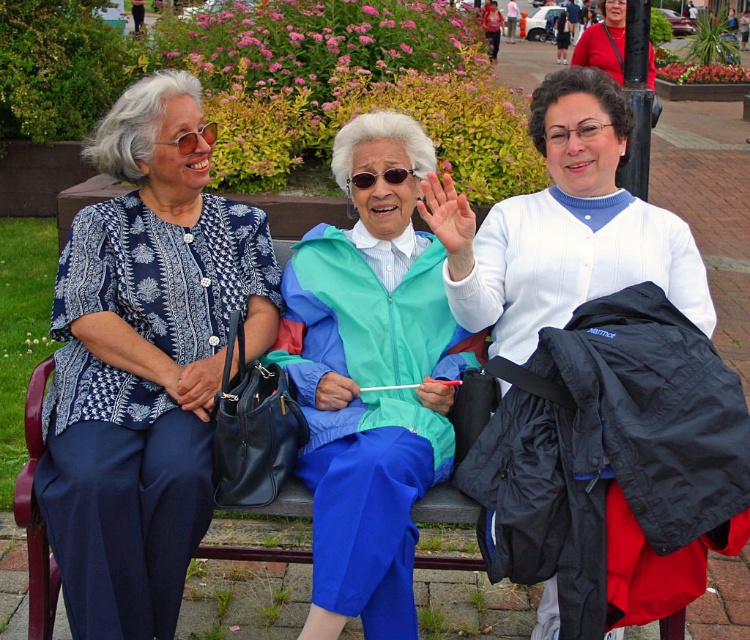
Question: Is matte blue blouse at left smaller than white matte cardigan at center?

Choices:
 (A) yes
 (B) no

Answer: (A)

Question: Can you confirm if matte blue blouse at left is positioned above teal matte jacket at center?

Choices:
 (A) no
 (B) yes

Answer: (B)

Question: Among these objects, which one is nearest to the camera?

Choices:
 (A) teal matte jacket at center
 (B) white matte cardigan at center

Answer: (A)

Question: Considering the relative positions of matte blue blouse at left and white matte cardigan at center in the image provided, where is matte blue blouse at left located with respect to white matte cardigan at center?

Choices:
 (A) below
 (B) above

Answer: (A)

Question: Which point is farther to the camera?

Choices:
 (A) teal matte jacket at center
 (B) white matte cardigan at center

Answer: (B)

Question: Based on their relative distances, which object is nearer to the teal matte jacket at center?

Choices:
 (A) matte blue blouse at left
 (B) white matte cardigan at center

Answer: (B)